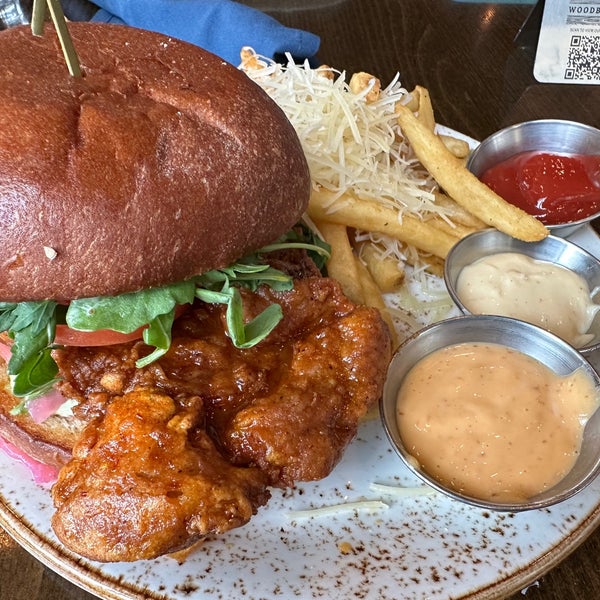
The width and height of the screenshot is (600, 600). In order to click on table in this screenshot , I will do point(32,582).